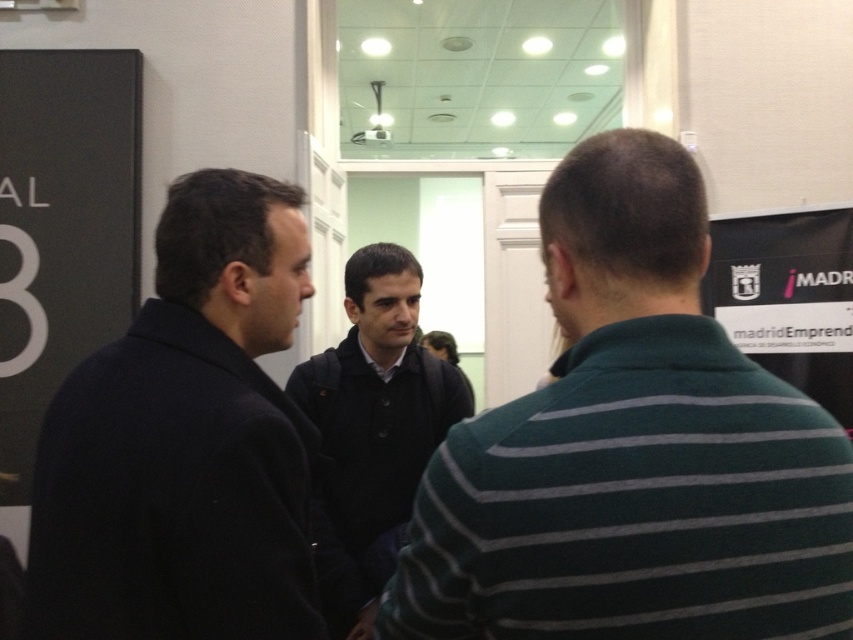
Based on the scene description, can you determine if the dark green striped polo shirt at center is wider than the dark blue wool coat at left?

The dark green striped polo shirt at center is wider than the dark blue wool coat at left according to the description.

Looking at this image, based on the scene description, which object is positioned higher in the image between the dark green striped polo shirt at center and the dark blue jacket at center?

The dark green striped polo shirt at center is positioned above the dark blue jacket at center according to the description.